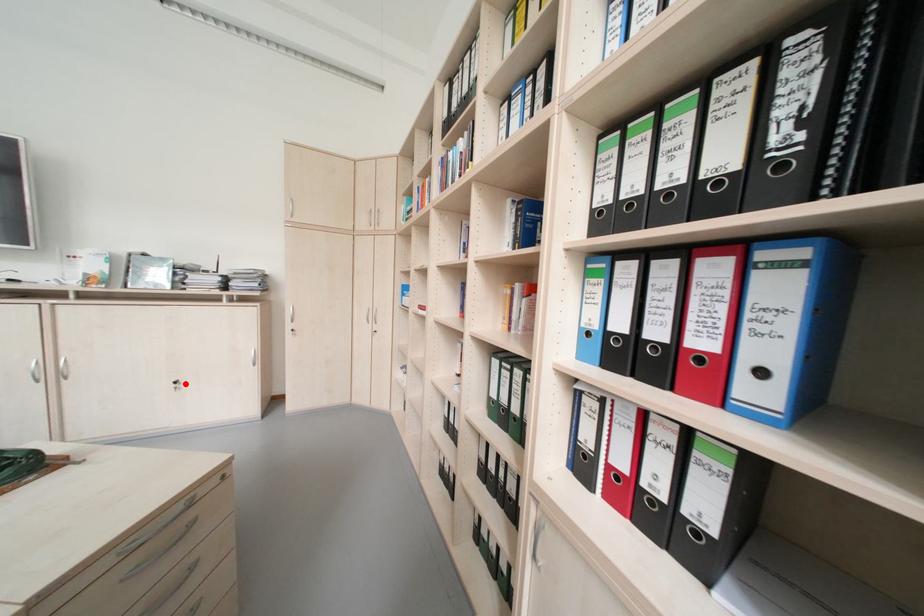
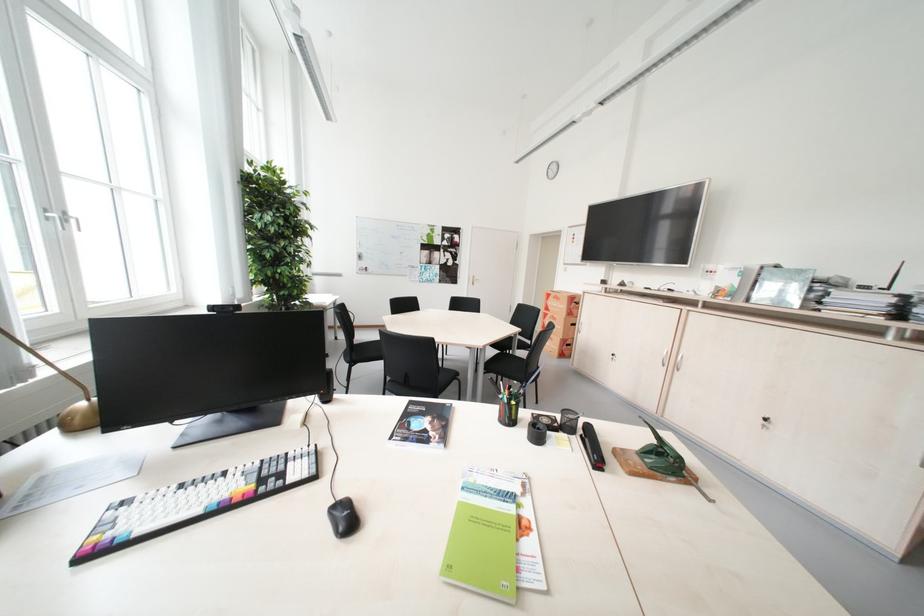
In the second image, find the point that corresponds to the highlighted location in the first image.

(775, 421)